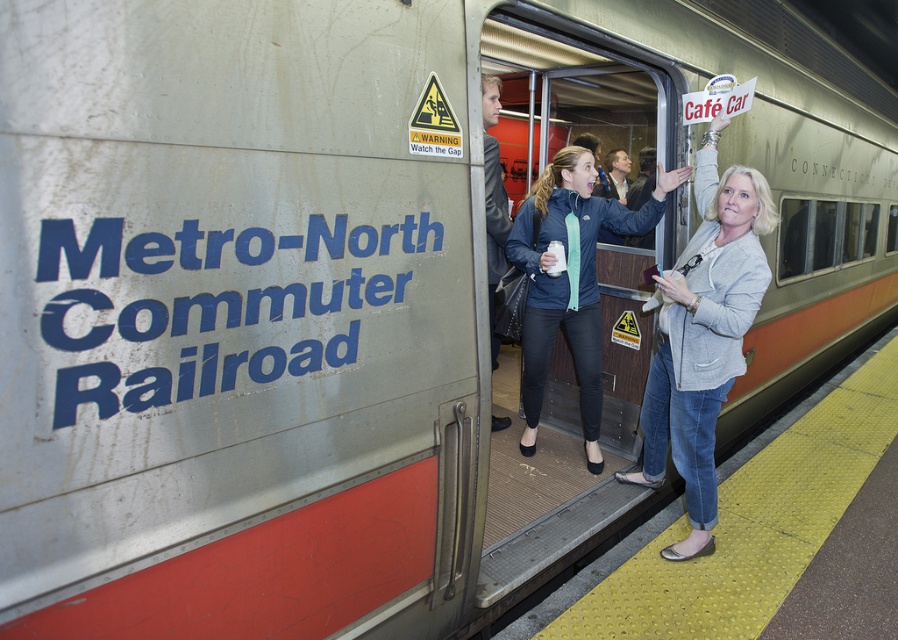
Can you confirm if light gray blazer at center is positioned to the left of matte blue jacket at center?

No, light gray blazer at center is not to the left of matte blue jacket at center.

Locate an element on the screen. light gray blazer at center is located at coordinates (703, 333).

Can you confirm if matte blue jacket at center is wider than dark gray jacket at center?

Yes, matte blue jacket at center is wider than dark gray jacket at center.

Who is shorter, matte blue jacket at center or dark gray jacket at center?

matte blue jacket at center

Identify the location of matte blue jacket at center. Image resolution: width=898 pixels, height=640 pixels. (571, 280).

Does light gray blazer at center appear over dark gray jacket at center?

No.

Measure the distance between light gray blazer at center and dark gray jacket at center.

light gray blazer at center and dark gray jacket at center are 3.54 feet apart.

Is point (710, 355) farther from viewer compared to point (503, 189)?

No, (710, 355) is closer to viewer.

I want to click on light gray blazer at center, so click(x=703, y=333).